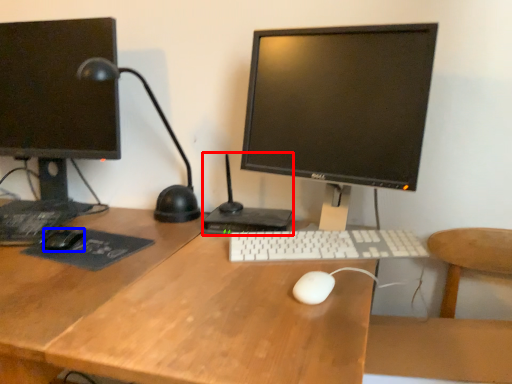
Question: Which of the following is the farthest to the observer, computer (highlighted by a red box) or mouse (highlighted by a blue box)?

Choices:
 (A) computer
 (B) mouse

Answer: (A)